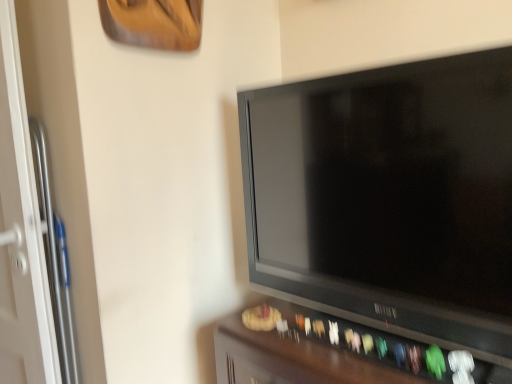
What do you see at coordinates (333, 352) in the screenshot? The width and height of the screenshot is (512, 384). I see `dark wood tv stand at lower center` at bounding box center [333, 352].

Locate an element on the screen. The width and height of the screenshot is (512, 384). dark wood tv stand at lower center is located at coordinates (333, 352).

Where is `black glossy tv at center`? black glossy tv at center is located at coordinates (389, 197).

The image size is (512, 384). What do you see at coordinates (389, 197) in the screenshot?
I see `black glossy tv at center` at bounding box center [389, 197].

Locate an element on the screen. dark wood tv stand at lower center is located at coordinates (333, 352).

Is black glossy tv at center to the right of dark wood tv stand at lower center from the viewer's perspective?

No.

Does black glossy tv at center come in front of dark wood tv stand at lower center?

Yes.

Does point (437, 244) come behind point (223, 338)?

That is False.

From the image's perspective, which is below, black glossy tv at center or dark wood tv stand at lower center?

From the image's view, dark wood tv stand at lower center is below.

In the scene shown: From a real-world perspective, is black glossy tv at center over dark wood tv stand at lower center?

Yes, from a real-world perspective, black glossy tv at center is above dark wood tv stand at lower center.

Which object is thinner, black glossy tv at center or dark wood tv stand at lower center?

Thinner between the two is black glossy tv at center.

Can you confirm if black glossy tv at center is shorter than dark wood tv stand at lower center?

No, black glossy tv at center is not shorter than dark wood tv stand at lower center.

Which of these two, black glossy tv at center or dark wood tv stand at lower center, is bigger?

dark wood tv stand at lower center is bigger.

Would you say black glossy tv at center is outside dark wood tv stand at lower center?

Yes, black glossy tv at center is not within dark wood tv stand at lower center.

Are black glossy tv at center and dark wood tv stand at lower center located far from each other?

They are positioned close to each other.

Is dark wood tv stand at lower center at the back of black glossy tv at center?

No, black glossy tv at center's orientation is not away from dark wood tv stand at lower center.

The image size is (512, 384). I want to click on furniture behind the black glossy tv at center, so click(333, 352).

Does dark wood tv stand at lower center appear on the left side of black glossy tv at center?

No.

Is dark wood tv stand at lower center further to the viewer compared to black glossy tv at center?

Yes.

Is point (278, 365) closer to viewer compared to point (353, 263)?

Yes, point (278, 365) is closer to viewer.

From the picture: From the image's perspective, relative to black glossy tv at center, is dark wood tv stand at lower center above or below?

dark wood tv stand at lower center is situated lower than black glossy tv at center in the image.

From a real-world perspective, is dark wood tv stand at lower center above or below black glossy tv at center?

From a real-world perspective, dark wood tv stand at lower center is physically below black glossy tv at center.

Considering the sizes of dark wood tv stand at lower center and black glossy tv at center in the image, is dark wood tv stand at lower center wider or thinner than black glossy tv at center?

Clearly, dark wood tv stand at lower center has more width compared to black glossy tv at center.

Considering the sizes of objects dark wood tv stand at lower center and black glossy tv at center in the image provided, who is taller, dark wood tv stand at lower center or black glossy tv at center?

black glossy tv at center is taller.

Is dark wood tv stand at lower center smaller than black glossy tv at center?

Actually, dark wood tv stand at lower center might be larger than black glossy tv at center.

Is black glossy tv at center completely or partially inside dark wood tv stand at lower center?

That's incorrect, black glossy tv at center is not inside dark wood tv stand at lower center.

Is dark wood tv stand at lower center next to black glossy tv at center?

No, dark wood tv stand at lower center is not touching black glossy tv at center.

Is dark wood tv stand at lower center aimed at black glossy tv at center?

No, dark wood tv stand at lower center is not turned towards black glossy tv at center.

You are a GUI agent. You are given a task and a screenshot of the screen. Output one action in this format:
    pyautogui.click(x=<x>, y=<y>)
    Task: Click on the television on the left of dark wood tv stand at lower center
    
    Given the screenshot: What is the action you would take?
    389,197

Where is `furniture to the right of black glossy tv at center`? This screenshot has height=384, width=512. furniture to the right of black glossy tv at center is located at coordinates (333, 352).

The width and height of the screenshot is (512, 384). Find the location of `furniture below the black glossy tv at center (from the image's perspective)`. furniture below the black glossy tv at center (from the image's perspective) is located at coordinates (333, 352).